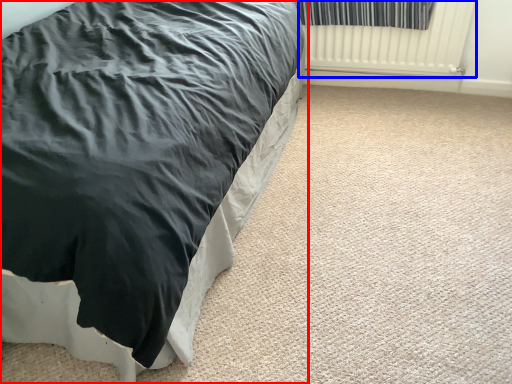
Question: Which point is further to the camera, bed (highlighted by a red box) or radiator (highlighted by a blue box)?

Choices:
 (A) bed
 (B) radiator

Answer: (B)